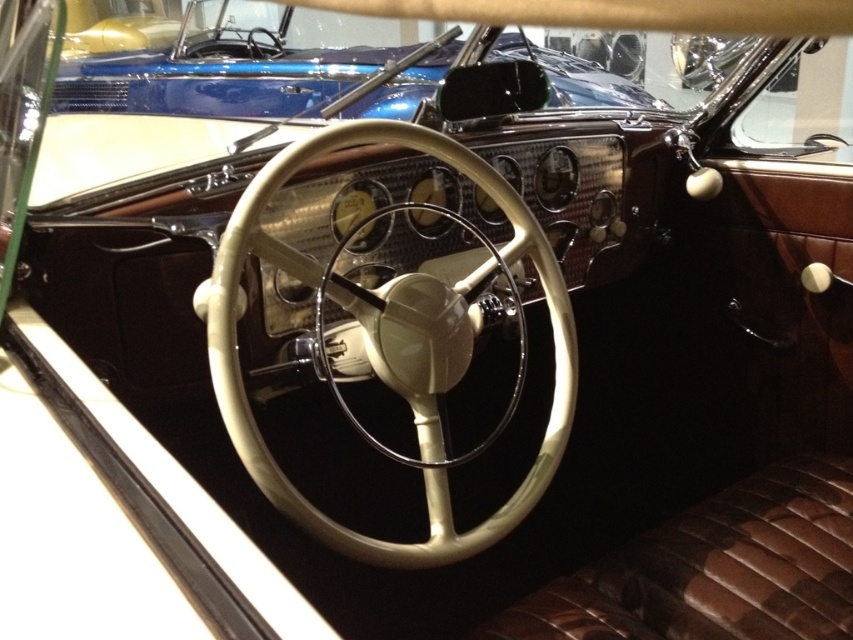
You are sitting in the driver seat of the vintage car. You notice the beige leather steering wheel at center and the metallic blue car at upper center. Which object is closer to you?

The beige leather steering wheel at center is closer to you because it is positioned in front of the metallic blue car at upper center.

You are a mechanic working on a vintage car. You need to install a camera that must be placed exactly 36 inches away from the beige leather steering wheel at center to avoid obstructing the driver. Based on the image, will the current placement of the camera meet this requirement?

The beige leather steering wheel at center and camera are 34.73 inches apart, which is less than the required 36 inches. Therefore, the current placement does not meet the requirement and the camera is too close.